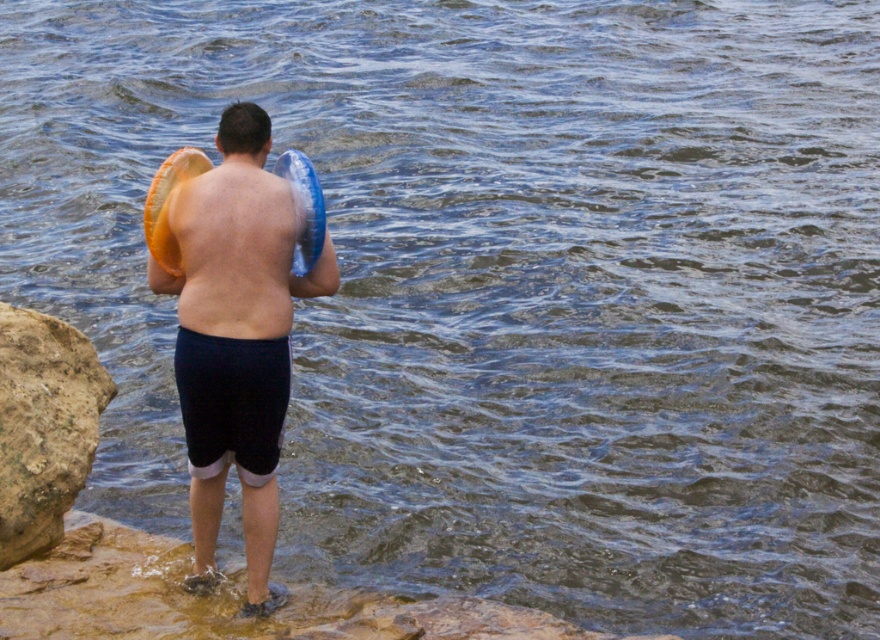
Does matte orange frisbee at center have a lesser width compared to brown rough rock at lower left?

Incorrect, matte orange frisbee at center's width is not less than brown rough rock at lower left's.

Which is behind, point (178, 268) or point (13, 376)?

The point (13, 376) is behind.

Where is `matte orange frisbee at center`? The image size is (880, 640). matte orange frisbee at center is located at coordinates (235, 317).

Is matte orange frisbee at center shorter than matte skin at center?

No, matte orange frisbee at center is not shorter than matte skin at center.

Is matte orange frisbee at center bigger than matte skin at center?

Yes, matte orange frisbee at center is bigger than matte skin at center.

Which is in front, point (209, 461) or point (264, 150)?

Positioned in front is point (264, 150).

Image resolution: width=880 pixels, height=640 pixels. What are the coordinates of `matte orange frisbee at center` in the screenshot? It's located at (235, 317).

Does brown rough rock at lower left come behind matte skin at center?

Yes, it is behind matte skin at center.

The image size is (880, 640). Describe the element at coordinates (44, 426) in the screenshot. I see `brown rough rock at lower left` at that location.

Image resolution: width=880 pixels, height=640 pixels. In order to click on brown rough rock at lower left in this screenshot , I will do `click(44, 426)`.